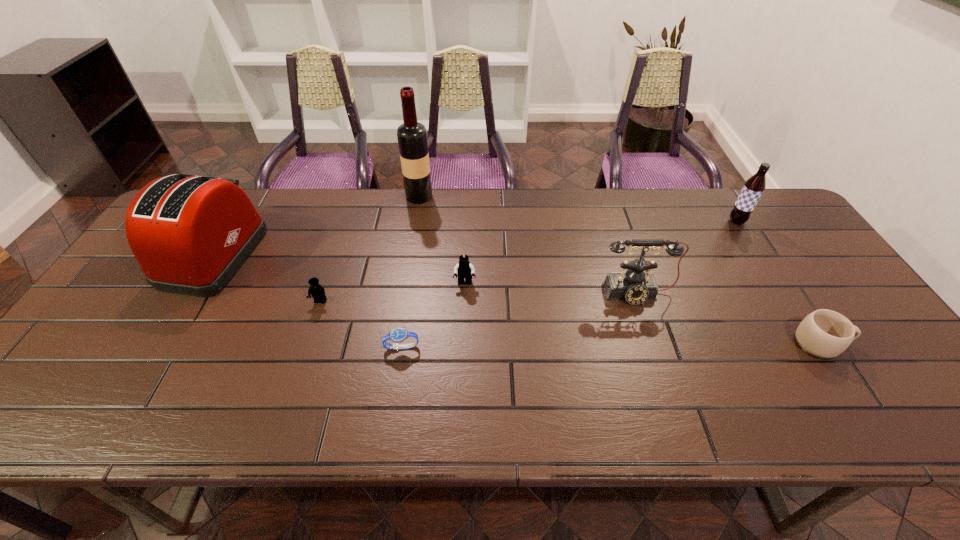
The height and width of the screenshot is (540, 960). What are the coordinates of `toaster that is at the far edge` in the screenshot? It's located at (190, 234).

Identify the location of root beer that is at the far edge. (753, 188).

Identify the location of object that is at the left edge. (190, 234).

Where is `root beer that is at the right edge`? This screenshot has height=540, width=960. root beer that is at the right edge is located at coordinates (753, 188).

What are the coordinates of `mug present at the right edge` in the screenshot? It's located at (824, 334).

The height and width of the screenshot is (540, 960). I want to click on object situated at the far left corner, so click(190, 234).

Locate an element on the screen. This screenshot has width=960, height=540. object that is at the far right corner is located at coordinates (753, 188).

You are a GUI agent. You are given a task and a screenshot of the screen. Output one action in this format:
    pyautogui.click(x=<x>, y=<y>)
    Task: Click on the free space at the far edge of the desktop
    
    Given the screenshot: What is the action you would take?
    pyautogui.click(x=690, y=195)

Image resolution: width=960 pixels, height=540 pixels. In order to click on free space at the near edge of the desktop in this screenshot , I will do `click(494, 420)`.

Identify the location of vacant space at the left edge of the desktop. The height and width of the screenshot is (540, 960). (127, 354).